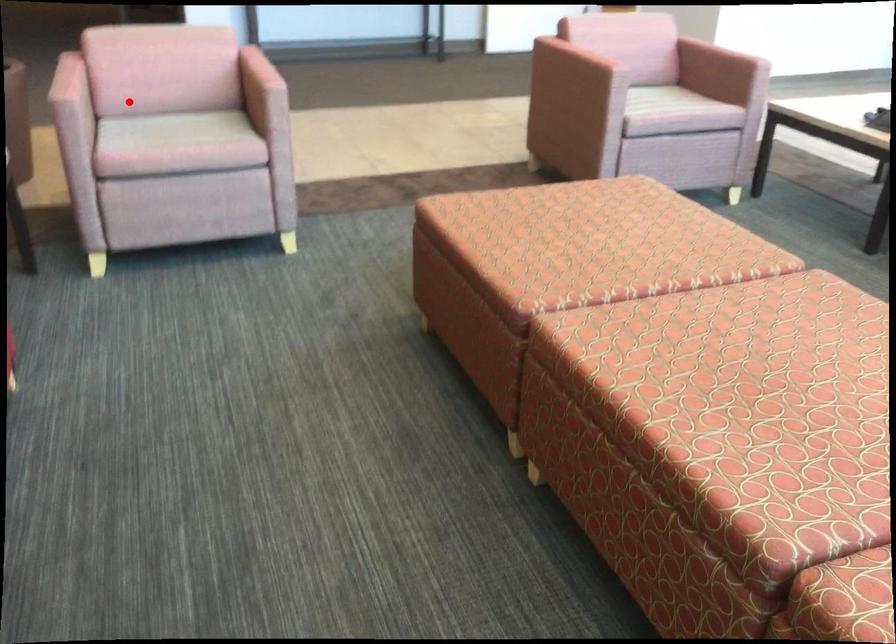
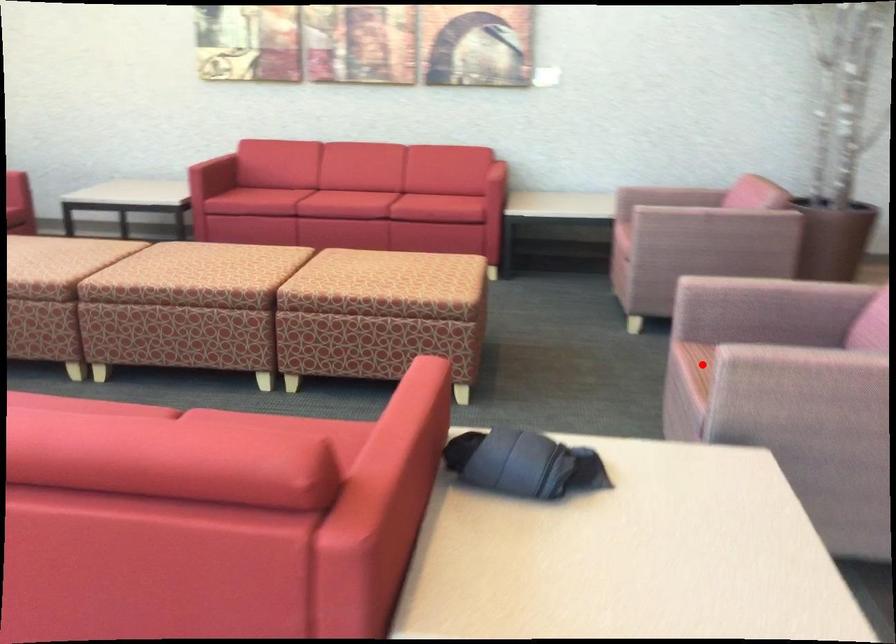
Looking at this image, I am providing you with two images of the same scene from different viewpoints. A red point is marked on the first image and another point is marked on the second image. Is the marked point in image1 the same physical position as the marked point in image2?

No